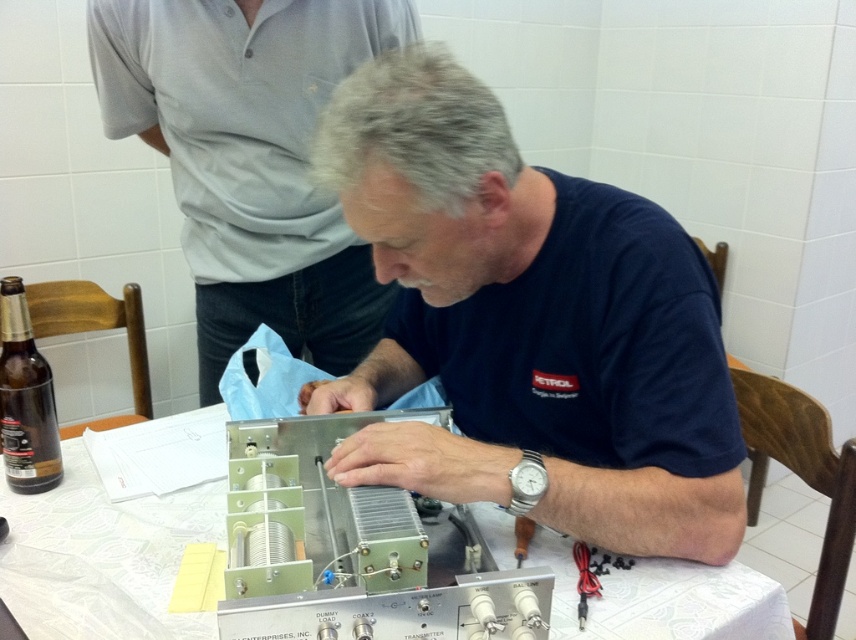
Consider the image. You are a technician working on the metallic electronic device. You need to place a document on the table near the white paper at center. Where should you place it?

The white paper at center is located at coordinates point (132, 506), so place the document near that position.

What is located at the coordinates point (528,323) in the image?

The point (528,323) marks the blue fabric at center.